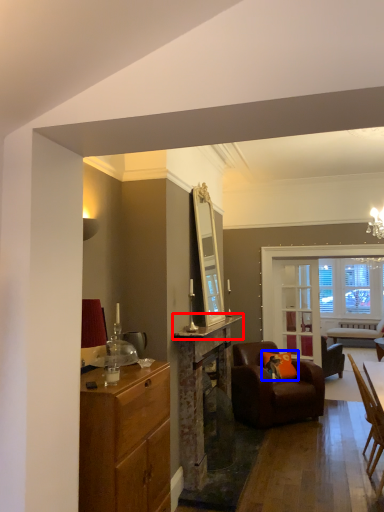
Question: Which point is closer to the camera, counter top (highlighted by a red box) or pillow (highlighted by a blue box)?

Choices:
 (A) counter top
 (B) pillow

Answer: (A)